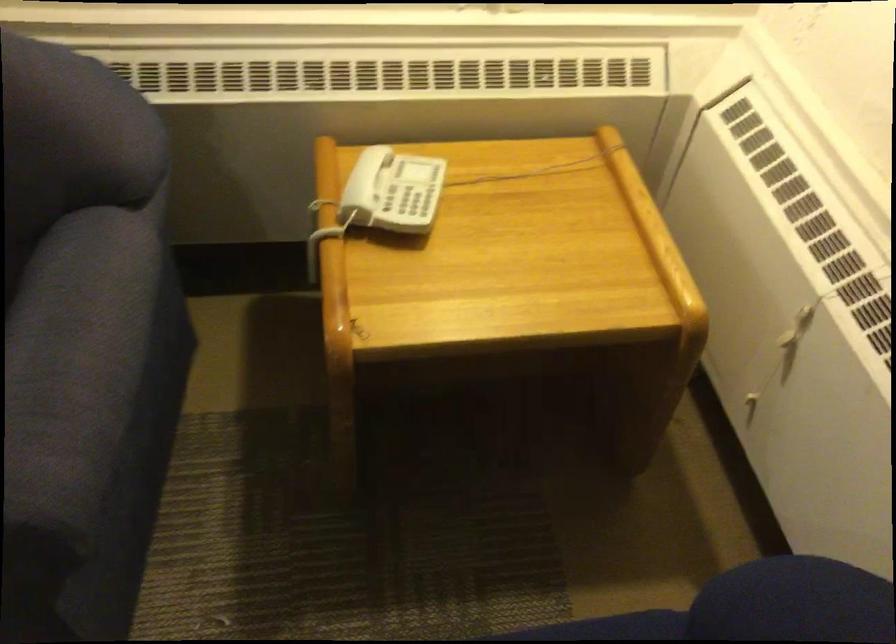
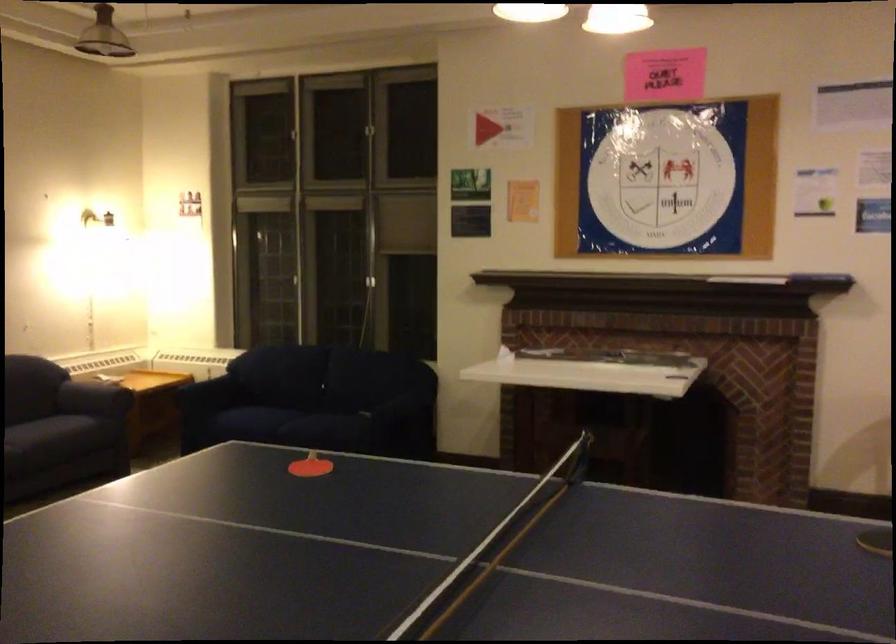
Question: I am providing you with two images of the same scene from different viewpoints. Please identify which objects are invisible in image2.

Choices:
 (A) white control button
 (B) dark sofa armrest
 (C) dark sofa sitting surface
 (D) telephone button

Answer: (D)